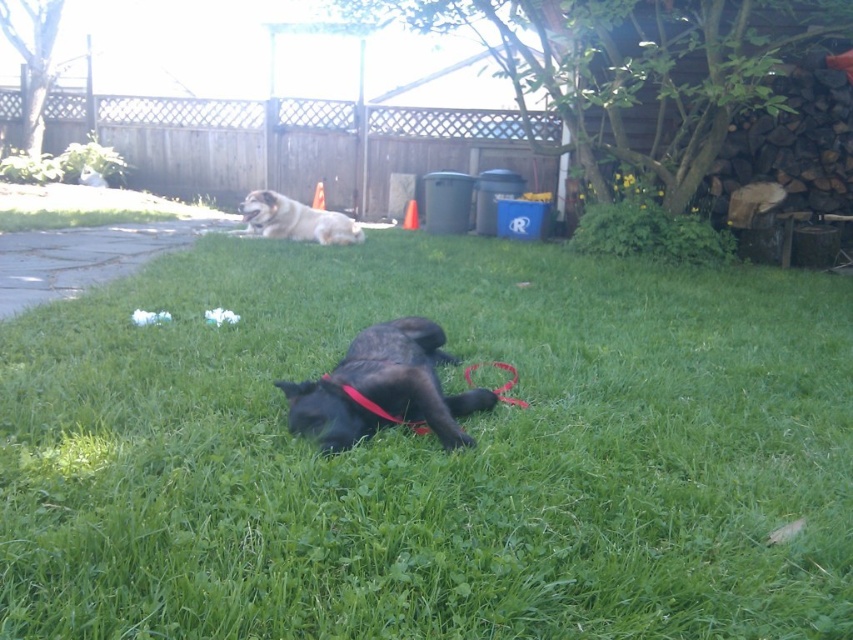
Question: Does green grass at center appear over fuzzy brown dog at upper center?

Choices:
 (A) no
 (B) yes

Answer: (A)

Question: Which point appears farthest from the camera in this image?

Choices:
 (A) (469, 392)
 (B) (250, 205)

Answer: (B)

Question: Based on their relative distances, which object is nearer to the shiny black dog at center?

Choices:
 (A) fuzzy brown dog at upper center
 (B) green grass at center

Answer: (B)

Question: Is green grass at center bigger than fuzzy brown dog at upper center?

Choices:
 (A) no
 (B) yes

Answer: (B)

Question: Can you confirm if green grass at center is positioned above fuzzy brown dog at upper center?

Choices:
 (A) no
 (B) yes

Answer: (A)

Question: Which of the following is the farthest from the observer?

Choices:
 (A) shiny black dog at center
 (B) green grass at center
 (C) fuzzy brown dog at upper center

Answer: (C)